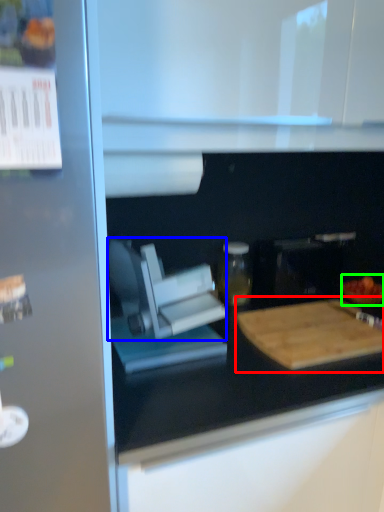
Question: Estimate the real-world distances between objects in this image. Which object is closer to cutting board (highlighted by a red box), appliance (highlighted by a blue box) or food (highlighted by a green box)?

Choices:
 (A) appliance
 (B) food

Answer: (B)